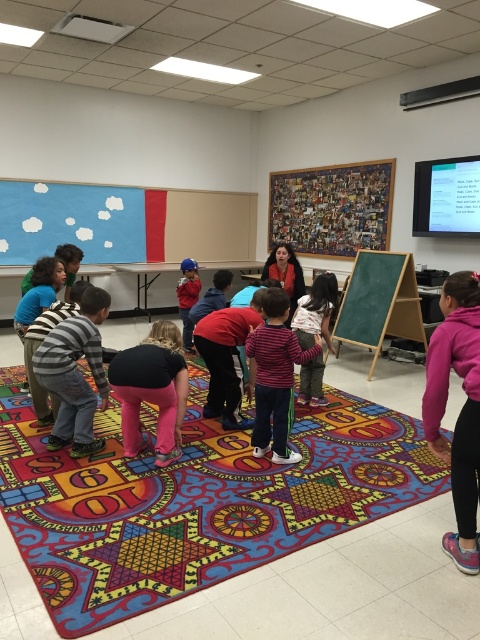
Question: Is black fabric shirt at center behind striped cotton shirt at center?

Choices:
 (A) no
 (B) yes

Answer: (A)

Question: Estimate the real-world distances between objects in this image. Which object is closer to the pink fleece jacket at lower right?

Choices:
 (A) multicolored carpet at center
 (B) striped cotton shirt at center
 (C) striped shirt at center

Answer: (B)

Question: Is green chalkboard at center positioned before matte red sweater at center?

Choices:
 (A) yes
 (B) no

Answer: (B)

Question: Can you confirm if striped cotton shirt at center is positioned to the right of matte red shirt at center?

Choices:
 (A) yes
 (B) no

Answer: (A)

Question: Which of these objects is positioned farthest from the striped shirt at center?

Choices:
 (A) pink fleece jacket at lower right
 (B) black fabric shirt at center

Answer: (A)

Question: Which of the following is the farthest from the observer?

Choices:
 (A) (183, 369)
 (B) (331, 531)
 (C) (326, 342)
 (D) (192, 301)

Answer: (D)